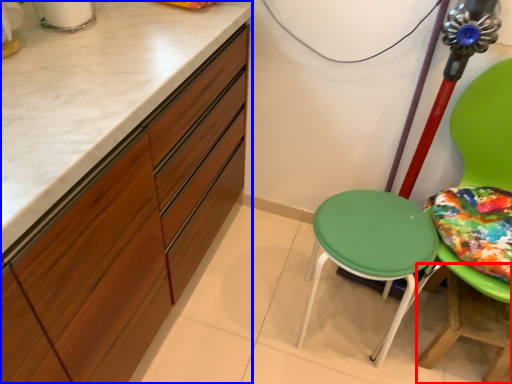
Question: Among these objects, which one is farthest to the camera, table (highlighted by a red box) or cabinetry (highlighted by a blue box)?

Choices:
 (A) table
 (B) cabinetry

Answer: (A)